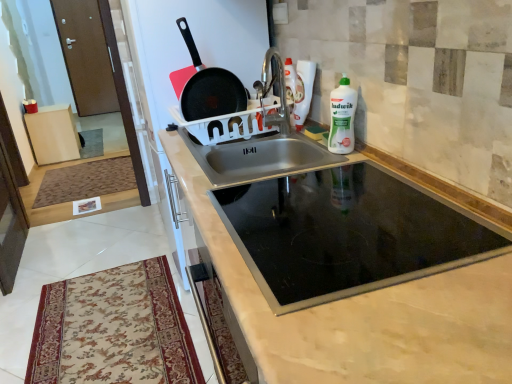
Question: Is black glass cooktop at center aimed at brown textured mat at lower left, marked as the first mat in a top-to-bottom arrangement?

Choices:
 (A) yes
 (B) no

Answer: (B)

Question: From a real-world perspective, does black glass cooktop at center sit lower than brown textured mat at lower left, marked as the second mat in a right-to-left arrangement?

Choices:
 (A) yes
 (B) no

Answer: (B)

Question: Does black glass cooktop at center have a smaller size compared to brown textured mat at lower left, the 1th mat from the left?

Choices:
 (A) yes
 (B) no

Answer: (B)

Question: Is brown textured mat at lower left, marked as the second mat in a right-to-left arrangement, surrounded by black glass cooktop at center?

Choices:
 (A) yes
 (B) no

Answer: (B)

Question: Is black glass cooktop at center behind brown textured mat at lower left, the 1th mat from the left?

Choices:
 (A) no
 (B) yes

Answer: (A)

Question: Is the depth of black glass cooktop at center less than that of brown textured mat at lower left, which is the second mat in bottom-to-top order?

Choices:
 (A) yes
 (B) no

Answer: (A)

Question: Is black matte frying pan at upper center aimed at beige floral rug at lower left, arranged as the 2th mat when viewed from the back?

Choices:
 (A) no
 (B) yes

Answer: (A)

Question: Is black matte frying pan at upper center positioned far away from beige floral rug at lower left, acting as the first mat starting from the front?

Choices:
 (A) no
 (B) yes

Answer: (B)

Question: From a real-world perspective, is black matte frying pan at upper center under beige floral rug at lower left, the 2th mat positioned from the left?

Choices:
 (A) yes
 (B) no

Answer: (B)

Question: Would you say beige floral rug at lower left, acting as the first mat starting from the front, is part of black matte frying pan at upper center's contents?

Choices:
 (A) yes
 (B) no

Answer: (B)

Question: Considering the relative sizes of black matte frying pan at upper center and beige floral rug at lower left, acting as the first mat starting from the front, in the image provided, is black matte frying pan at upper center smaller than beige floral rug at lower left, acting as the first mat starting from the front,?

Choices:
 (A) no
 (B) yes

Answer: (B)

Question: Can you confirm if black matte frying pan at upper center is thinner than beige floral rug at lower left, which is counted as the second mat, starting from the top?

Choices:
 (A) no
 (B) yes

Answer: (B)

Question: Is the surface of white plastic bottle at upper right in direct contact with brown textured mat at lower left, marked as the first mat in a top-to-bottom arrangement?

Choices:
 (A) no
 (B) yes

Answer: (A)